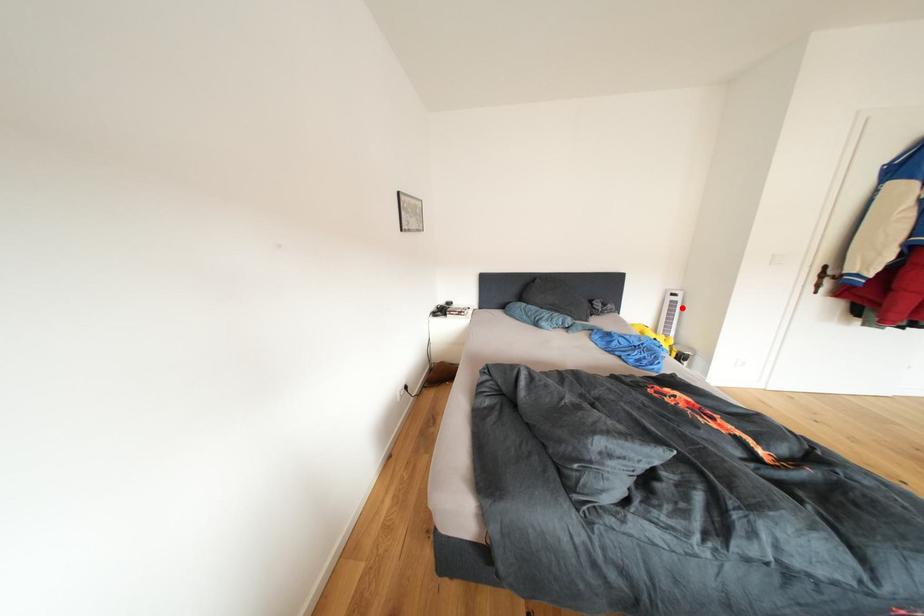
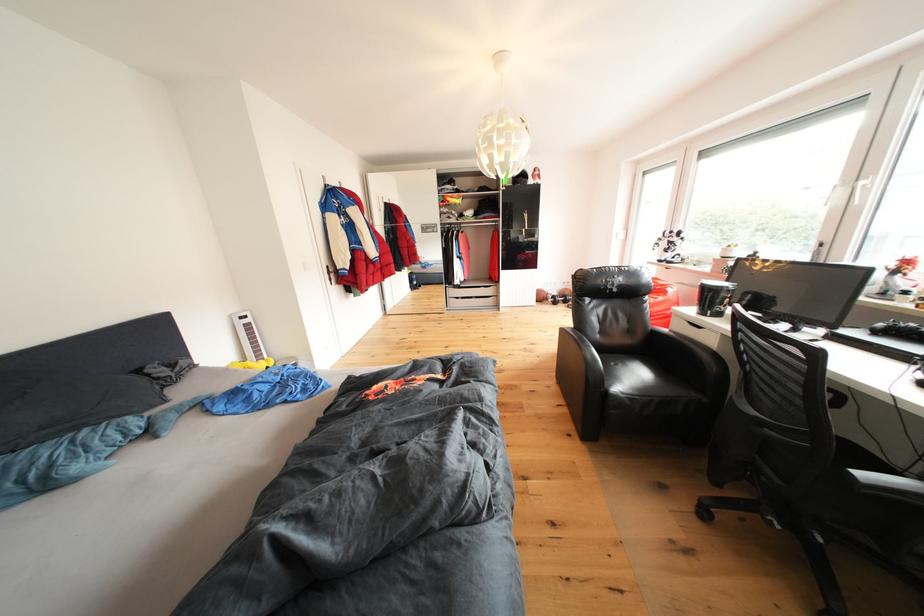
Question: A red point is marked in image1. In image2, is the corresponding 3D point closer to the camera or farther? Reply with the corresponding letter.

Choices:
 (A) The corresponding 3D point is closer.
 (B) The corresponding 3D point is farther.

Answer: (A)